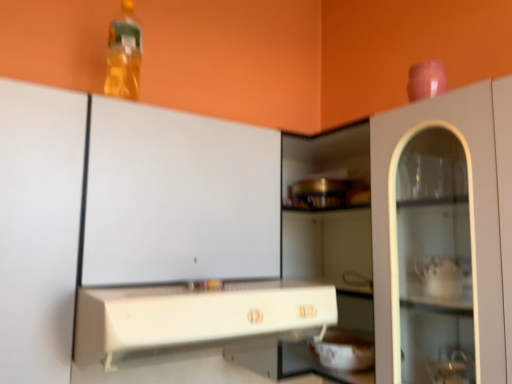
Question: Would you say white glossy bowl at lower center is a long distance from translucent plastic bottle at upper left?

Choices:
 (A) yes
 (B) no

Answer: (B)

Question: Can you confirm if white glossy bowl at lower center is taller than translucent plastic bottle at upper left?

Choices:
 (A) yes
 (B) no

Answer: (B)

Question: From a real-world perspective, does white glossy bowl at lower center sit lower than translucent plastic bottle at upper left?

Choices:
 (A) no
 (B) yes

Answer: (B)

Question: Would you say translucent plastic bottle at upper left is part of white glossy bowl at lower center's contents?

Choices:
 (A) yes
 (B) no

Answer: (B)

Question: From the image's perspective, does white glossy bowl at lower center appear lower than translucent plastic bottle at upper left?

Choices:
 (A) yes
 (B) no

Answer: (A)

Question: From the image's perspective, would you say white glossy bowl at lower center is positioned over translucent plastic bottle at upper left?

Choices:
 (A) yes
 (B) no

Answer: (B)

Question: Does white plastic countertop at center turn towards white glossy bowl at lower center?

Choices:
 (A) no
 (B) yes

Answer: (A)

Question: From the image's perspective, is white plastic countertop at center located beneath white glossy bowl at lower center?

Choices:
 (A) yes
 (B) no

Answer: (B)

Question: Is white plastic countertop at center in front of white glossy bowl at lower center?

Choices:
 (A) yes
 (B) no

Answer: (A)

Question: Considering the relative positions of white plastic countertop at center and white glossy bowl at lower center in the image provided, is white plastic countertop at center to the right of white glossy bowl at lower center from the viewer's perspective?

Choices:
 (A) yes
 (B) no

Answer: (B)

Question: Are white plastic countertop at center and white glossy bowl at lower center far apart?

Choices:
 (A) no
 (B) yes

Answer: (A)

Question: Can you confirm if white plastic countertop at center is positioned to the left of white glossy bowl at lower center?

Choices:
 (A) no
 (B) yes

Answer: (B)

Question: Can you confirm if white glossy bowl at lower center is taller than white plastic countertop at center?

Choices:
 (A) yes
 (B) no

Answer: (B)